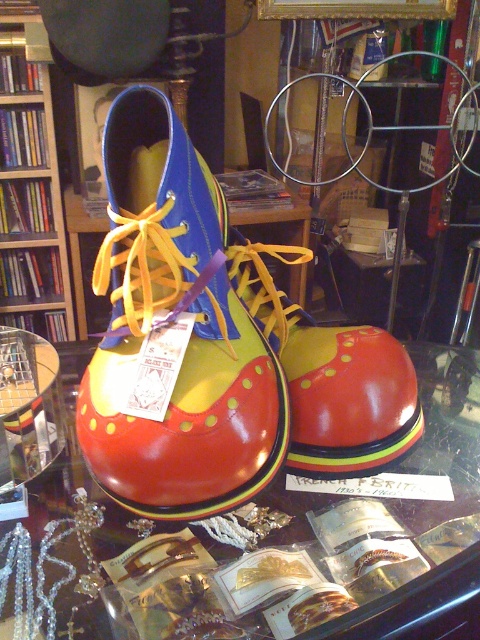
Question: Where is transparent glass table at center located in relation to wooden bookshelf at left in the image?

Choices:
 (A) right
 (B) left

Answer: (A)

Question: Is glossy leather clown shoe at center below glossy clown shoe at center?

Choices:
 (A) no
 (B) yes

Answer: (A)

Question: Which of these objects is positioned closest to the glossy clown shoe at center?

Choices:
 (A) transparent glass table at center
 (B) glossy leather clown shoe at center

Answer: (B)

Question: Which of the following is the closest to the observer?

Choices:
 (A) transparent glass table at center
 (B) wooden bookshelf at left
 (C) glossy leather clown shoe at center

Answer: (A)

Question: Which point is closer to the camera?

Choices:
 (A) glossy clown shoe at center
 (B) transparent glass table at center
 (C) wooden bookshelf at left

Answer: (B)

Question: Can you confirm if glossy leather clown shoe at center is smaller than glossy clown shoe at center?

Choices:
 (A) yes
 (B) no

Answer: (B)